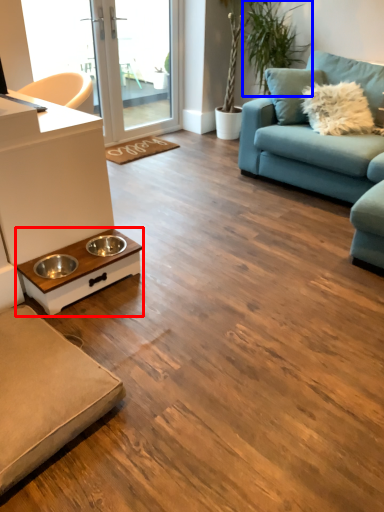
Question: Among these objects, which one is nearest to the camera, coffee table (highlighted by a red box) or plant (highlighted by a blue box)?

Choices:
 (A) coffee table
 (B) plant

Answer: (A)